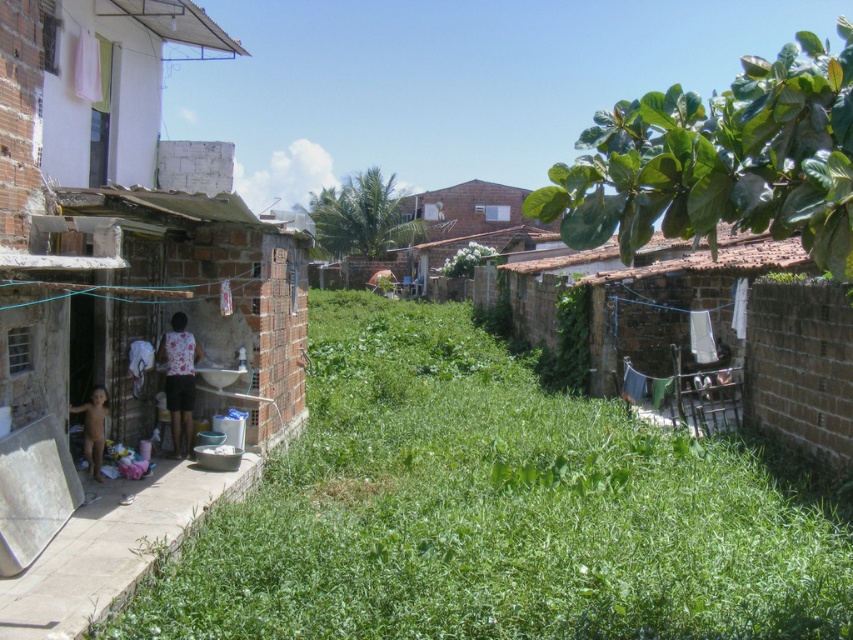
Question: Is green leafy plant at upper right bigger than white concrete alley at lower left?

Choices:
 (A) no
 (B) yes

Answer: (B)

Question: Which point is closer to the camera?

Choices:
 (A) green leafy grass at lower left
 (B) green leafy plant at upper right
 (C) brick wall at left

Answer: (B)

Question: Can you confirm if green leafy grass at lower left is positioned below green leafy plant at upper right?

Choices:
 (A) no
 (B) yes

Answer: (B)

Question: Is green leafy grass at lower left positioned at the back of brick wall at left?

Choices:
 (A) yes
 (B) no

Answer: (B)

Question: Which of these objects is positioned farthest from the green leafy plant at upper right?

Choices:
 (A) brick wall at left
 (B) green leafy grass at lower left
 (C) white concrete alley at lower left

Answer: (A)

Question: Which object is the farthest from the green leafy grass at lower left?

Choices:
 (A) white concrete alley at lower left
 (B) brick wall at left

Answer: (B)